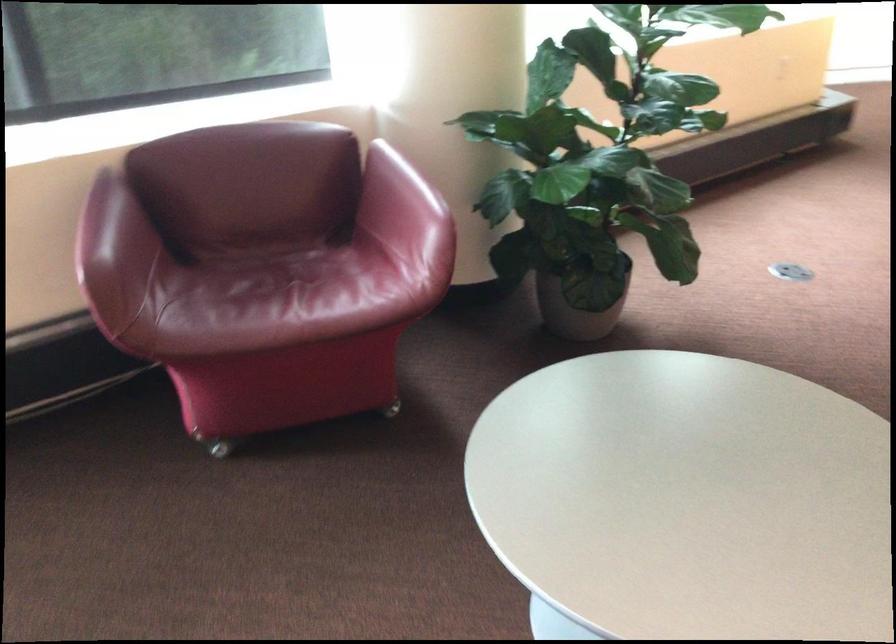
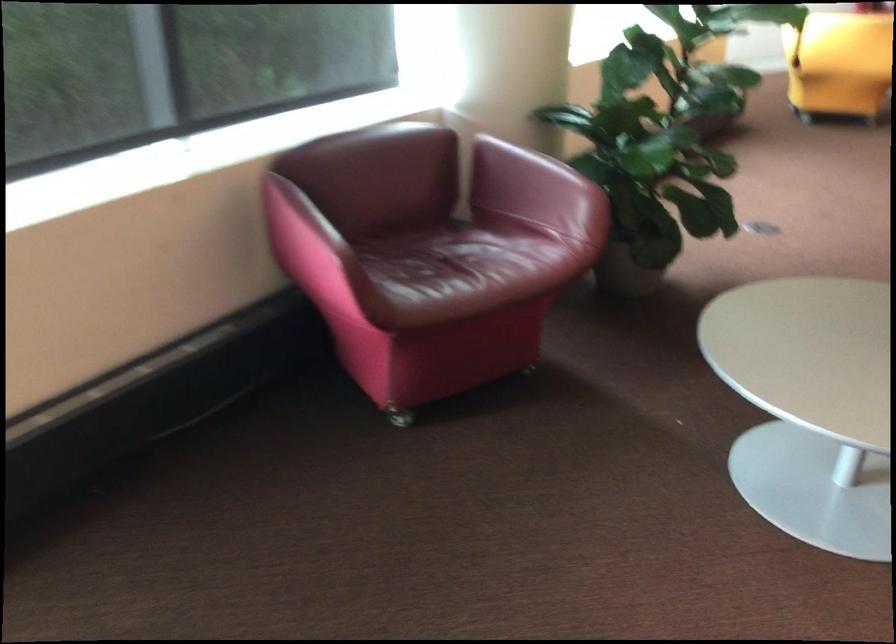
Locate, in the second image, the point that corresponds to (297,292) in the first image.

(466, 266)